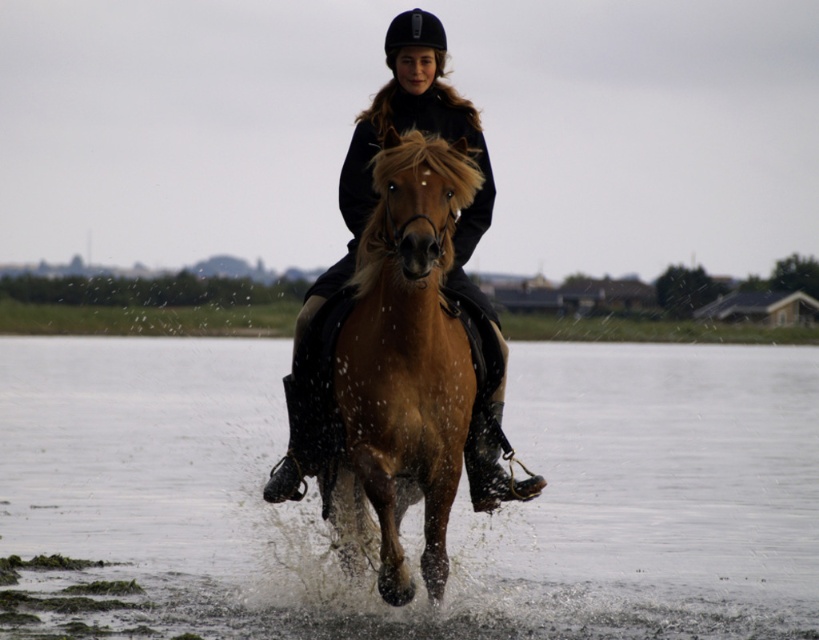
Looking at this image, does clear water at lower center have a larger size compared to brown glossy horse at center?

Indeed, clear water at lower center has a larger size compared to brown glossy horse at center.

Who is positioned more to the right, clear water at lower center or brown glossy horse at center?

clear water at lower center is more to the right.

Which is behind, point (61, 524) or point (449, 342)?

The point (61, 524) is behind.

I want to click on clear water at lower center, so click(419, 502).

Consider the image. Can you confirm if clear water at lower center is smaller than shiny black helmet at center?

Incorrect, clear water at lower center is not smaller in size than shiny black helmet at center.

Is point (62, 490) positioned in front of point (460, 260)?

That is False.

The width and height of the screenshot is (819, 640). In order to click on clear water at lower center in this screenshot , I will do `click(419, 502)`.

Is the position of brown glossy horse at center more distant than that of shiny black helmet at center?

No, it is not.

Can you confirm if brown glossy horse at center is wider than shiny black helmet at center?

Yes.

The image size is (819, 640). I want to click on brown glossy horse at center, so click(x=406, y=355).